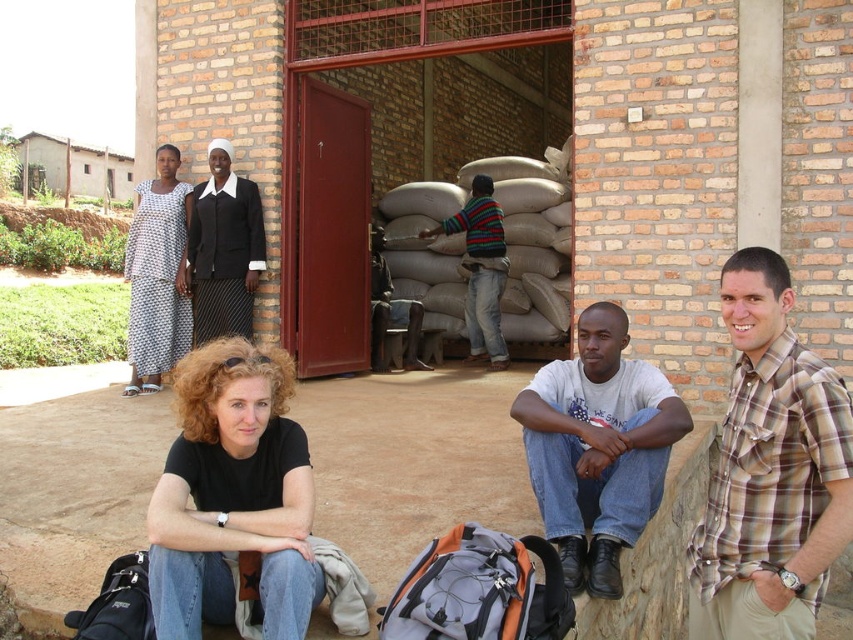
Question: Which point is closer to the camera taking this photo?

Choices:
 (A) (187, 196)
 (B) (247, 230)

Answer: (B)

Question: Is light gray t-shirt at center behind striped sweater at center?

Choices:
 (A) yes
 (B) no

Answer: (B)

Question: Does light gray t-shirt at center have a smaller size compared to black fabric skirt at upper left?

Choices:
 (A) yes
 (B) no

Answer: (B)

Question: Observing the image, what is the correct spatial positioning of light gray t-shirt at center in reference to striped sweater at center?

Choices:
 (A) left
 (B) right

Answer: (B)

Question: Among these objects, which one is farthest from the camera?

Choices:
 (A) white dotted dress at center
 (B) light gray t-shirt at center
 (C) black fabric skirt at upper left

Answer: (A)

Question: Estimate the real-world distances between objects in this image. Which object is closer to the black cotton shirt at lower left?

Choices:
 (A) white dotted dress at center
 (B) striped sweater at center
 (C) brown plaid shirt at right

Answer: (C)